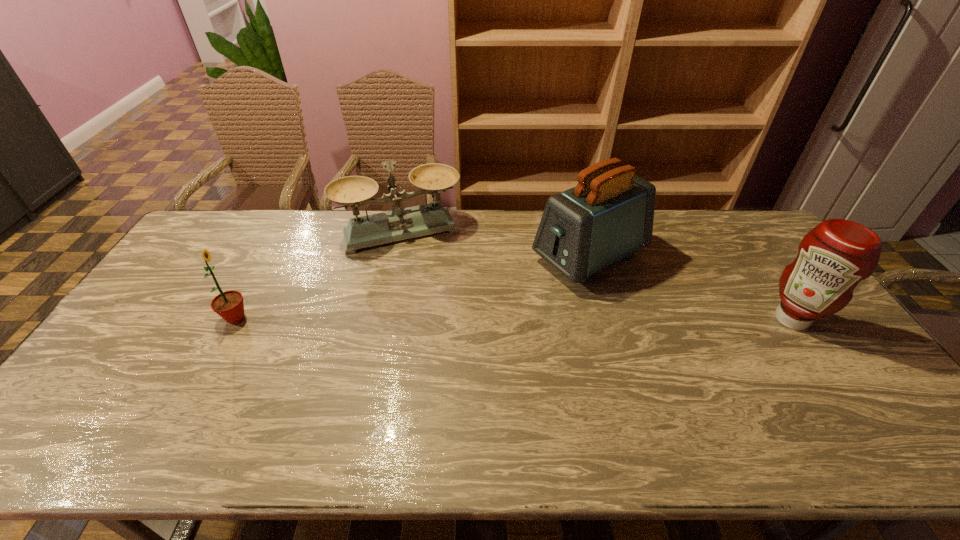
At what (x,y) coordinates should I click in order to perform the action: click on blank region between the condiment and the second object from left to right. Please return your answer as a coordinate pair (x, y). This screenshot has width=960, height=540. Looking at the image, I should click on (596, 275).

The width and height of the screenshot is (960, 540). Identify the location of empty location between the rightmost object and the second object from right to left. (690, 288).

Where is `free spot between the sunflower and the condiment`? The image size is (960, 540). free spot between the sunflower and the condiment is located at coordinates (514, 319).

Locate an element on the screen. free space between the third object from left to right and the second object from left to right is located at coordinates (495, 244).

Locate an element on the screen. This screenshot has width=960, height=540. empty space that is in between the condiment and the third object from left to right is located at coordinates [x=690, y=288].

Find the location of a particular element. The image size is (960, 540). vacant space in between the rightmost object and the second object from left to right is located at coordinates (596, 275).

This screenshot has height=540, width=960. Find the location of `unoccupied position between the condiment and the toaster`. unoccupied position between the condiment and the toaster is located at coordinates (690, 288).

What are the coordinates of `free area in between the leftmost object and the third object from left to right` in the screenshot? It's located at (413, 287).

Find the location of `empty location between the condiment and the scale`. empty location between the condiment and the scale is located at coordinates (596, 275).

What are the coordinates of `object that can be found as the third closest to the third object from right to left` in the screenshot? It's located at point(837,254).